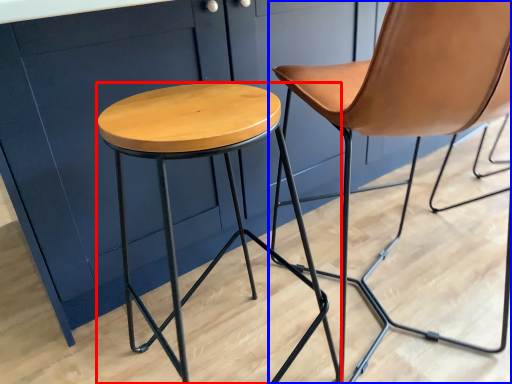
Question: Which of the following is the farthest to the observer, stool (highlighted by a red box) or chair (highlighted by a blue box)?

Choices:
 (A) stool
 (B) chair

Answer: (B)